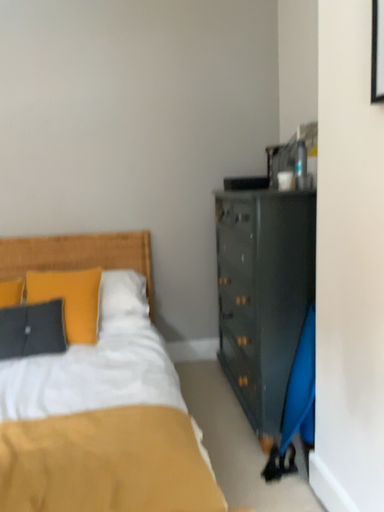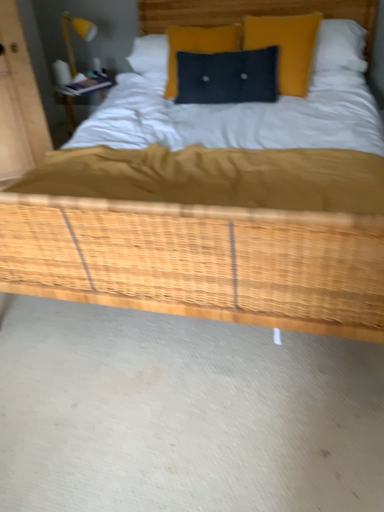
Question: How did the camera likely rotate when shooting the video?

Choices:
 (A) rotated downward
 (B) rotated upward

Answer: (A)